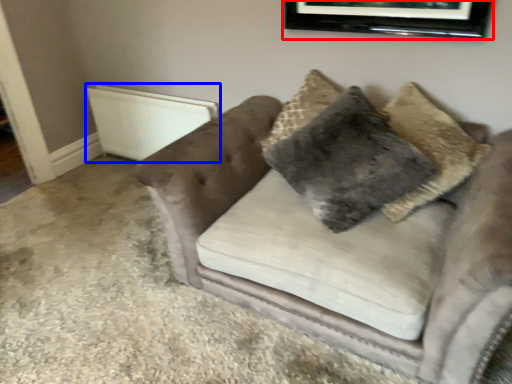
Question: Which object appears farthest to the camera in this image, picture frame (highlighted by a red box) or radiator (highlighted by a blue box)?

Choices:
 (A) picture frame
 (B) radiator

Answer: (B)